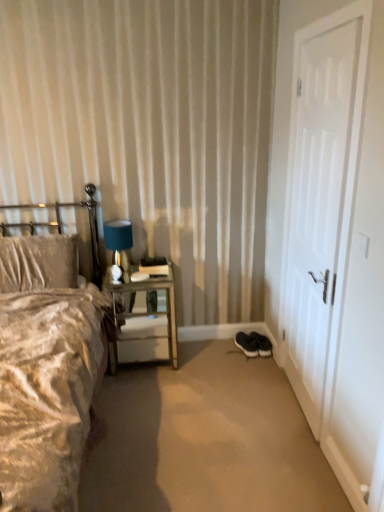
Identify the location of metallic silver headboard at left. Image resolution: width=384 pixels, height=512 pixels. (62, 224).

Consider the image. What is the approximate height of metallic silver nightstand at left?

metallic silver nightstand at left is 26.37 inches in height.

I want to click on white matte door at right, so click(320, 196).

From the image's perspective, is metallic silver headboard at left above or below blue fabric lampshade at upper left?

Based on their image positions, metallic silver headboard at left is located beneath blue fabric lampshade at upper left.

Is metallic silver headboard at left not inside blue fabric lampshade at upper left?

Yes, metallic silver headboard at left is not within blue fabric lampshade at upper left.

From a real-world perspective, which object stands above the other?

blue fabric lampshade at upper left.

Based on the photo, how far apart are metallic silver headboard at left and blue fabric lampshade at upper left?

They are 8.86 inches apart.

Is metallic silver headboard at left in front of velvet beige bed at left?

That is False.

Where is `headboard above the velvet beige bed at left (from the image's perspective)`? The height and width of the screenshot is (512, 384). headboard above the velvet beige bed at left (from the image's perspective) is located at coordinates (62, 224).

What's the angular difference between metallic silver headboard at left and velvet beige bed at left's facing directions?

0.000222 degrees.

Is point (0, 226) behind point (88, 311)?

That is True.

Can you tell me how much velvet beige bed at left and blue fabric lampshade at upper left differ in facing direction?

There is a 0.000264-degree angle between the facing directions of velvet beige bed at left and blue fabric lampshade at upper left.

Is velvet beige bed at left looking in the opposite direction of blue fabric lampshade at upper left?

No, blue fabric lampshade at upper left is not at the back of velvet beige bed at left.

Is velvet beige bed at left far away from blue fabric lampshade at upper left?

No, velvet beige bed at left is not far from blue fabric lampshade at upper left.

Is velvet beige bed at left taller or shorter than blue fabric lampshade at upper left?

Considering their sizes, velvet beige bed at left has more height than blue fabric lampshade at upper left.

From the picture: Can you tell me how much velvet beige bed at left and metallic silver headboard at left differ in facing direction?

0.000222 degrees.

Is velvet beige bed at left taller or shorter than metallic silver headboard at left?

In the image, velvet beige bed at left appears to be taller than metallic silver headboard at left.

From the image's perspective, between velvet beige bed at left and metallic silver headboard at left, which one is located above?

metallic silver headboard at left is shown above in the image.

Is velvet beige bed at left bigger or smaller than metallic silver headboard at left?

velvet beige bed at left is bigger than metallic silver headboard at left.

Is white matte door at right bigger than metallic silver headboard at left?

Indeed, white matte door at right has a larger size compared to metallic silver headboard at left.

Is white matte door at right positioned before metallic silver headboard at left?

Yes, white matte door at right is closer to the viewer.

From the image's perspective, which one is positioned lower, white matte door at right or metallic silver headboard at left?

metallic silver headboard at left.

Does point (334, 352) lie in front of point (90, 188)?

Yes, point (334, 352) is closer to viewer.

Is point (118, 356) closer to camera compared to point (267, 343)?

Yes, point (118, 356) is closer to viewer.

Is metallic silver nightstand at left not near black suede sneakers at lower center, which is counted as the first footwear, starting from the right?

No, metallic silver nightstand at left is not far from black suede sneakers at lower center, which is counted as the first footwear, starting from the right.

Is metallic silver nightstand at left turned away from black suede sneakers at lower center, acting as the 2th footwear starting from the left?

No, metallic silver nightstand at left is not facing away from black suede sneakers at lower center, acting as the 2th footwear starting from the left.

Locate an element on the screen. Image resolution: width=384 pixels, height=512 pixels. bed above the black suede sneakers at lower right, positioned as the first footwear in left-to-right order (from the image's perspective) is located at coordinates (46, 370).

Can you tell me how much velvet beige bed at left and black suede sneakers at lower right, arranged as the 2th footwear when viewed from the right, differ in facing direction?

11.4 degrees.

Between velvet beige bed at left and black suede sneakers at lower right, arranged as the 2th footwear when viewed from the right, which one appears on the left side from the viewer's perspective?

From the viewer's perspective, velvet beige bed at left appears more on the left side.

Measure the distance from velvet beige bed at left to black suede sneakers at lower right, positioned as the first footwear in left-to-right order.

Result: 1.37 meters.

Where is `table lamp located behind the metallic silver headboard at left`? The height and width of the screenshot is (512, 384). table lamp located behind the metallic silver headboard at left is located at coordinates (119, 244).

Where is `headboard located on the left of velvet beige bed at left`? Image resolution: width=384 pixels, height=512 pixels. headboard located on the left of velvet beige bed at left is located at coordinates (62, 224).

Considering their positions, is blue fabric lampshade at upper left positioned closer to black suede sneakers at lower right, positioned as the first footwear in left-to-right order, than black suede sneakers at lower center, which is counted as the first footwear, starting from the right?

The object closer to black suede sneakers at lower right, positioned as the first footwear in left-to-right order, is black suede sneakers at lower center, which is counted as the first footwear, starting from the right.

Which object lies further to the anchor point metallic silver nightstand at left, velvet beige bed at left or metallic silver headboard at left?

Based on the image, velvet beige bed at left appears to be further to metallic silver nightstand at left.

From the image, which object appears to be nearer to velvet beige bed at left, black rubber shoes at lower right or metallic silver nightstand at left?

The object closer to velvet beige bed at left is metallic silver nightstand at left.

Looking at the image, which one is located further to black rubber shoes at lower right, black suede sneakers at lower center, which is counted as the first footwear, starting from the right, or velvet beige bed at left?

black suede sneakers at lower center, which is counted as the first footwear, starting from the right.

When comparing their distances from metallic silver headboard at left, does black suede sneakers at lower right, positioned as the first footwear in left-to-right order, or white matte door at right seem further?

white matte door at right.

When comparing their distances from black suede sneakers at lower right, positioned as the first footwear in left-to-right order, does metallic silver headboard at left or metallic silver nightstand at left seem closer?

Based on the image, metallic silver nightstand at left appears to be nearer to black suede sneakers at lower right, positioned as the first footwear in left-to-right order.

Based on their spatial positions, is white matte door at right or velvet beige bed at left closer to metallic silver headboard at left?

Among the two, velvet beige bed at left is located nearer to metallic silver headboard at left.

When comparing their distances from velvet beige bed at left, does black rubber shoes at lower right or white matte door at right seem closer?

black rubber shoes at lower right is closer to velvet beige bed at left.

Identify the location of table lamp between white matte door at right and black suede sneakers at lower right, positioned as the first footwear in left-to-right order, along the z-axis. The width and height of the screenshot is (384, 512). (119, 244).

The width and height of the screenshot is (384, 512). In order to click on headboard located between velvet beige bed at left and black suede sneakers at lower center, which is counted as the first footwear, starting from the right, in the depth direction in this screenshot , I will do `click(62, 224)`.

Where is `plain between metallic silver headboard at left and white matte door at right from left to right`? This screenshot has width=384, height=512. plain between metallic silver headboard at left and white matte door at right from left to right is located at coordinates (206, 439).

This screenshot has width=384, height=512. Find the location of `plain between white matte door at right and metallic silver nightstand at left in the front-back direction`. plain between white matte door at right and metallic silver nightstand at left in the front-back direction is located at coordinates (206, 439).